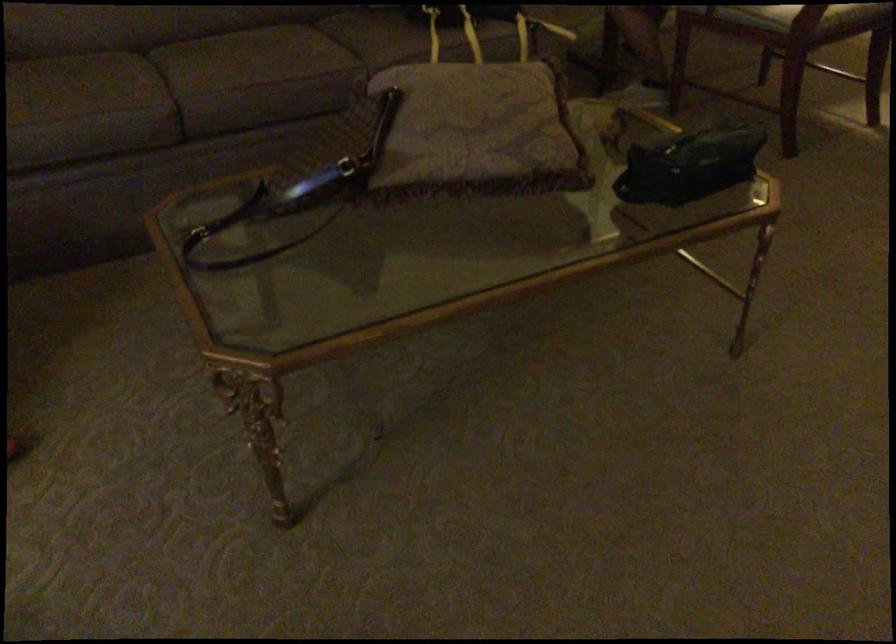
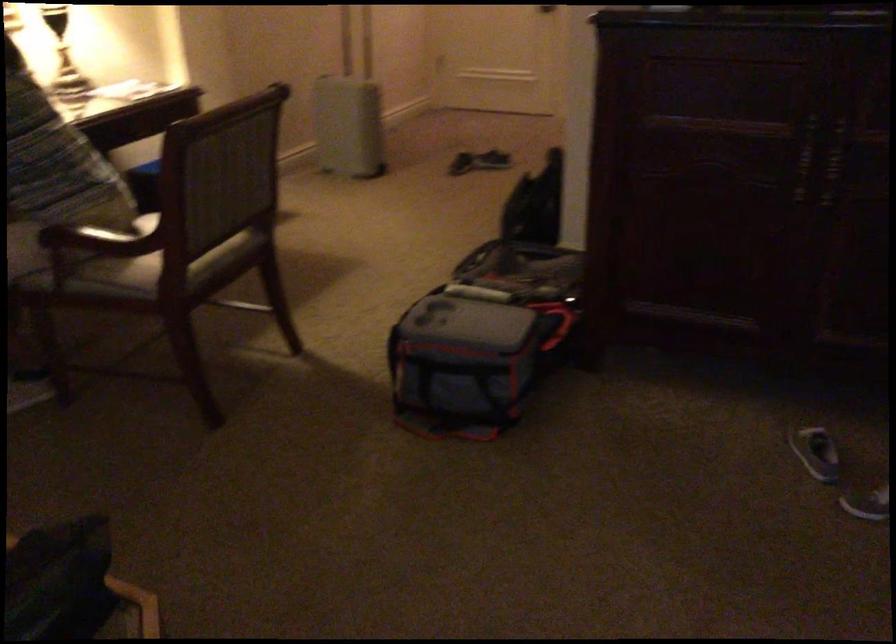
Question: The camera is either moving clockwise (left) or counter-clockwise (right) around the object. The first image is from the beginning of the video and the second image is from the end. Is the camera moving left or right when shooting the video?

Choices:
 (A) Left
 (B) Right

Answer: (A)